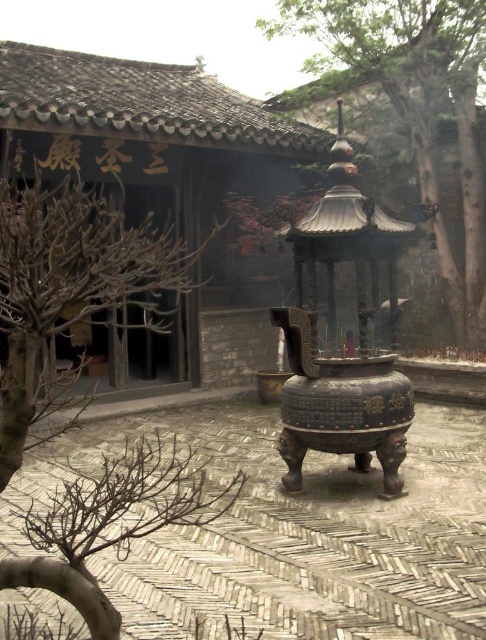
Question: In this image, where is bare branches at upper left located relative to green textured tree at upper center?

Choices:
 (A) right
 (B) left

Answer: (B)

Question: Where is bare branches at upper left located in relation to green textured tree at upper center in the image?

Choices:
 (A) right
 (B) left

Answer: (B)

Question: Which point is farther to the camera?

Choices:
 (A) (342, 17)
 (B) (68, 180)

Answer: (A)

Question: Is bare branches at upper left above green textured tree at upper center?

Choices:
 (A) no
 (B) yes

Answer: (A)